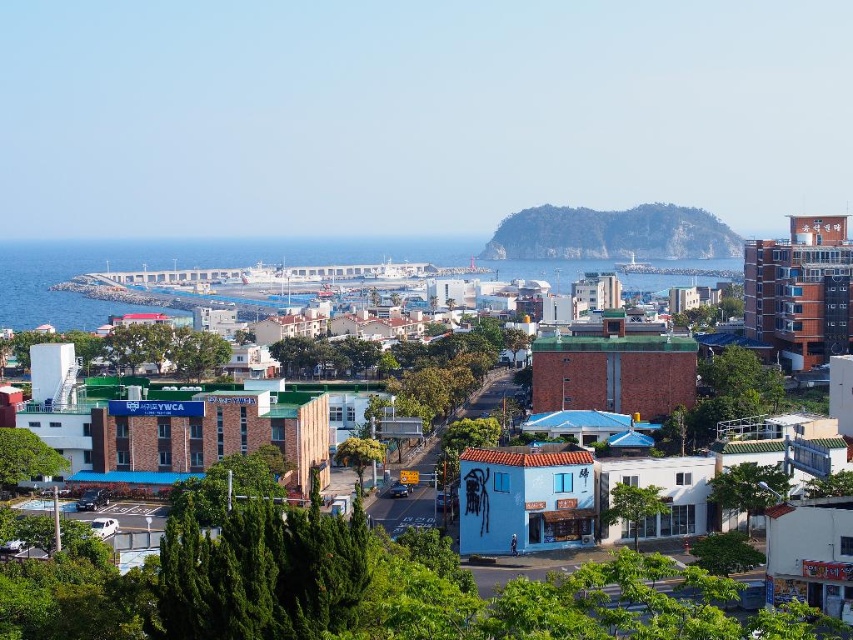
Between brown brick building at center and green rocky island at center, which one has more height?

With more height is brown brick building at center.

Can you confirm if brown brick building at center is thinner than green rocky island at center?

Correct, brown brick building at center's width is less than green rocky island at center's.

Is point (4, 509) positioned in front of point (598, 257)?

Yes, point (4, 509) is closer to viewer.

The width and height of the screenshot is (853, 640). What are the coordinates of `brown brick building at center` in the screenshot? It's located at (361, 586).

Who is more forward, [0,576] or [379,241]?

Point [0,576]

Does brown brick building at center have a greater height compared to blue concrete water at center?

Incorrect, brown brick building at center's height is not larger of blue concrete water at center's.

Does point (386, 609) come farther from viewer compared to point (416, 248)?

No, (386, 609) is in front of (416, 248).

The height and width of the screenshot is (640, 853). In order to click on brown brick building at center in this screenshot , I will do `click(361, 586)`.

Image resolution: width=853 pixels, height=640 pixels. What do you see at coordinates (173, 266) in the screenshot? I see `blue concrete water at center` at bounding box center [173, 266].

Who is lower down, blue concrete water at center or green rocky island at center?

blue concrete water at center

Is point (3, 272) farther from camera compared to point (601, 214)?

Yes, point (3, 272) is behind point (601, 214).

The width and height of the screenshot is (853, 640). I want to click on blue concrete water at center, so click(173, 266).